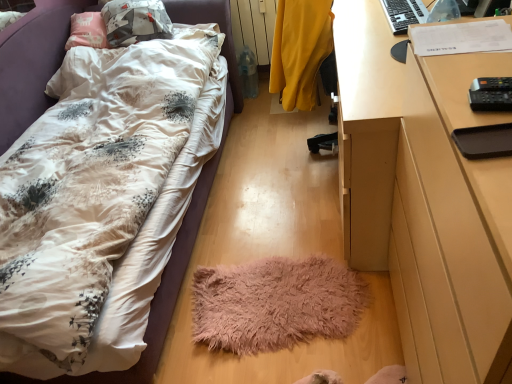
You are a GUI agent. You are given a task and a screenshot of the screen. Output one action in this format:
    pyautogui.click(x=<x>, y=<y>)
    Task: Click on the free space behind black plastic remote control at right
    
    Given the screenshot: What is the action you would take?
    pyautogui.click(x=467, y=66)